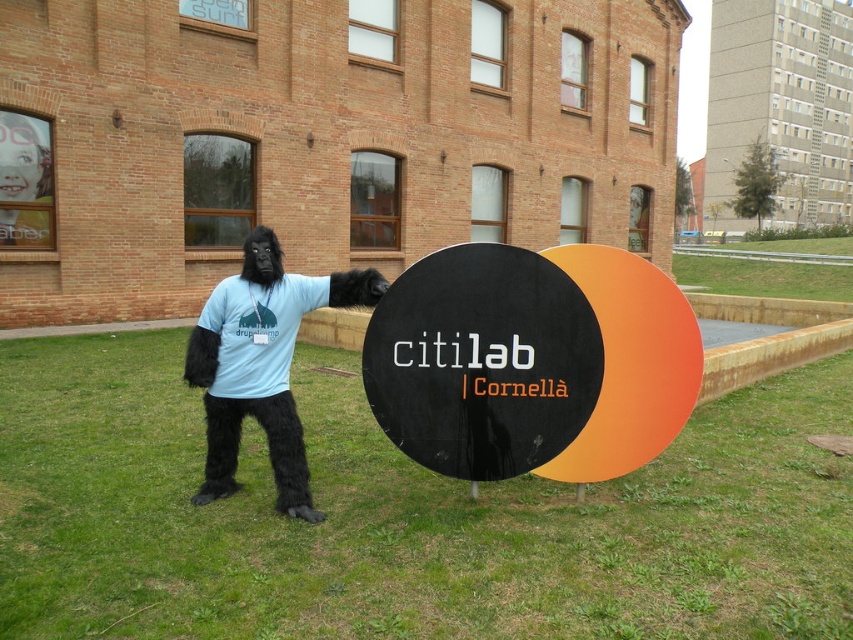
Question: Which of these objects is positioned closest to the green grass at center?

Choices:
 (A) matte black gorilla suit at center
 (B) black matte sign at center

Answer: (B)

Question: Estimate the real-world distances between objects in this image. Which object is closer to the black matte sign at center?

Choices:
 (A) matte black gorilla suit at center
 (B) green grass at center

Answer: (B)

Question: Does fuzzy black gorilla at center appear under matte black gorilla suit at center?

Choices:
 (A) no
 (B) yes

Answer: (B)

Question: In this image, where is fuzzy black gorilla at center located relative to matte black gorilla suit at center?

Choices:
 (A) left
 (B) right

Answer: (B)

Question: Does green grass at center come in front of black matte sign at center?

Choices:
 (A) yes
 (B) no

Answer: (A)

Question: Which point is farther to the camera?

Choices:
 (A) matte black gorilla suit at center
 (B) fuzzy black gorilla at center

Answer: (A)